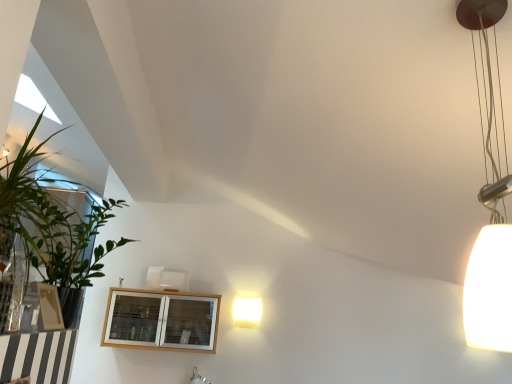
This screenshot has width=512, height=384. Describe the element at coordinates (161, 320) in the screenshot. I see `wooden cabinet at lower left` at that location.

At what (x,y) coordinates should I click in order to perform the action: click on green leafy plant at left. Please return your answer as a coordinate pair (x, y). Looking at the image, I should click on (50, 221).

The height and width of the screenshot is (384, 512). Find the location of `white matte lampshade at right, which is the 1th lamp in front-to-back order`. white matte lampshade at right, which is the 1th lamp in front-to-back order is located at coordinates (489, 196).

Does wooden cabinet at lower left have a greater height compared to matte white lamp at center, which is the first lamp from left to right?

Correct, wooden cabinet at lower left is much taller as matte white lamp at center, which is the first lamp from left to right.

Is wooden cabinet at lower left bigger or smaller than matte white lamp at center, the 1th lamp when ordered from bottom to top?

In the image, wooden cabinet at lower left appears to be larger than matte white lamp at center, the 1th lamp when ordered from bottom to top.

Can you confirm if wooden cabinet at lower left is positioned to the left of matte white lamp at center, which is the first lamp from left to right?

Yes.

How many degrees apart are the facing directions of wooden cabinet at lower left and matte white lamp at center, arranged as the first lamp when viewed from the back?

0.00335 degrees.

Is matte white lamp at center, the 2th lamp when ordered from right to left, wider than white matte lampshade at right, the first lamp when ordered from top to bottom?

In fact, matte white lamp at center, the 2th lamp when ordered from right to left, might be narrower than white matte lampshade at right, the first lamp when ordered from top to bottom.

From the picture: Could you tell me if matte white lamp at center, which is the 2th lamp from front to back, is facing white matte lampshade at right, marked as the 2th lamp in a back-to-front arrangement?

Yes, matte white lamp at center, which is the 2th lamp from front to back, is oriented towards white matte lampshade at right, marked as the 2th lamp in a back-to-front arrangement.

Is matte white lamp at center, the 1th lamp when ordered from bottom to top, placed right next to white matte lampshade at right, which ranks as the 2th lamp in bottom-to-top order?

No, matte white lamp at center, the 1th lamp when ordered from bottom to top, is not next to white matte lampshade at right, which ranks as the 2th lamp in bottom-to-top order.

Is matte white lamp at center, the 1th lamp when ordered from bottom to top, taller than white matte lampshade at right, which is the 1th lamp in front-to-back order?

In fact, matte white lamp at center, the 1th lamp when ordered from bottom to top, may be shorter than white matte lampshade at right, which is the 1th lamp in front-to-back order.

Considering the relative sizes of wooden cabinet at lower left and white matte lampshade at right, the first lamp when ordered from top to bottom, in the image provided, is wooden cabinet at lower left shorter than white matte lampshade at right, the first lamp when ordered from top to bottom,?

Yes.

Between wooden cabinet at lower left and white matte lampshade at right, which ranks as the first lamp in right-to-left order, which one has larger size?

wooden cabinet at lower left.

What are the coordinates of `lamp that is the 2nd object to the right of the wooden cabinet at lower left, starting at the anchor` in the screenshot? It's located at (489, 196).

Would you say white matte lampshade at right, the first lamp when ordered from top to bottom, is part of wooden cabinet at lower left's contents?

No, white matte lampshade at right, the first lamp when ordered from top to bottom, is not inside wooden cabinet at lower left.

Is there a large distance between green leafy plant at left and matte white lamp at center, the 2th lamp when ordered from right to left?

green leafy plant at left is far away from matte white lamp at center, the 2th lamp when ordered from right to left.

From the image's perspective, would you say green leafy plant at left is shown under matte white lamp at center, which is the first lamp from left to right?

No, from the image's perspective, green leafy plant at left is not beneath matte white lamp at center, which is the first lamp from left to right.

Can you confirm if green leafy plant at left is smaller than matte white lamp at center, the 1th lamp when ordered from bottom to top?

No, green leafy plant at left is not smaller than matte white lamp at center, the 1th lamp when ordered from bottom to top.

From a real-world perspective, is white matte lampshade at right, which is counted as the 2th lamp, starting from the left, located higher than green leafy plant at left?

Yes, from a real-world perspective, white matte lampshade at right, which is counted as the 2th lamp, starting from the left, is above green leafy plant at left.

Which object is wider, white matte lampshade at right, marked as the 2th lamp in a back-to-front arrangement, or green leafy plant at left?

green leafy plant at left.

Is there a large distance between white matte lampshade at right, which is counted as the 2th lamp, starting from the left, and green leafy plant at left?

Absolutely, white matte lampshade at right, which is counted as the 2th lamp, starting from the left, is distant from green leafy plant at left.

Does point (487, 287) appear closer or farther from the camera than point (37, 166)?

Point (487, 287).

Based on their positions, is matte white lamp at center, the 2th lamp when ordered from right to left, located to the left or right of wooden cabinet at lower left?

In the image, matte white lamp at center, the 2th lamp when ordered from right to left, appears on the right side of wooden cabinet at lower left.

Consider the image. Is there a large distance between matte white lamp at center, arranged as the first lamp when viewed from the back, and wooden cabinet at lower left?

That's not correct — matte white lamp at center, arranged as the first lamp when viewed from the back, is a little close to wooden cabinet at lower left.

Can you confirm if matte white lamp at center, arranged as the first lamp when viewed from the back, is smaller than wooden cabinet at lower left?

Yes, matte white lamp at center, arranged as the first lamp when viewed from the back, is smaller than wooden cabinet at lower left.

From their relative heights in the image, would you say matte white lamp at center, which is the first lamp from left to right, is taller or shorter than wooden cabinet at lower left?

Considering their sizes, matte white lamp at center, which is the first lamp from left to right, has less height than wooden cabinet at lower left.

Which object is closer to the camera, white matte lampshade at right, which is the 1th lamp in front-to-back order, or wooden cabinet at lower left?

Positioned in front is white matte lampshade at right, which is the 1th lamp in front-to-back order.

What are the coordinates of `window directly beneath the white matte lampshade at right, which is counted as the 2th lamp, starting from the left (from a real-world perspective)` in the screenshot? It's located at (161, 320).

Would you say white matte lampshade at right, which ranks as the 2th lamp in bottom-to-top order, is outside wooden cabinet at lower left?

Yes, white matte lampshade at right, which ranks as the 2th lamp in bottom-to-top order, is not within wooden cabinet at lower left.

Is white matte lampshade at right, which ranks as the first lamp in right-to-left order, wider or thinner than wooden cabinet at lower left?

Clearly, white matte lampshade at right, which ranks as the first lamp in right-to-left order, has less width compared to wooden cabinet at lower left.

Find the location of a particular element. Image resolution: width=512 pixels, height=384 pixels. the 1st lamp positioned above the wooden cabinet at lower left (from a real-world perspective) is located at coordinates (247, 311).

The height and width of the screenshot is (384, 512). Identify the location of lamp behind the white matte lampshade at right, marked as the 2th lamp in a back-to-front arrangement. (247, 311).

Based on their spatial positions, is white matte lampshade at right, which ranks as the first lamp in right-to-left order, or matte white lamp at center, the 2th lamp when ordered from right to left, closer to wooden cabinet at lower left?

matte white lamp at center, the 2th lamp when ordered from right to left, is positioned closer to the anchor wooden cabinet at lower left.

Consider the image. Which object lies further to the anchor point green leafy plant at left, wooden cabinet at lower left or matte white lamp at center, arranged as the first lamp when viewed from the back?

Among the two, matte white lamp at center, arranged as the first lamp when viewed from the back, is located further to green leafy plant at left.

From the image, which object appears to be nearer to wooden cabinet at lower left, white matte lampshade at right, which is the 1th lamp in front-to-back order, or green leafy plant at left?

Among the two, green leafy plant at left is located nearer to wooden cabinet at lower left.

Based on their spatial positions, is matte white lamp at center, which is the first lamp from left to right, or white matte lampshade at right, which is the 1th lamp in front-to-back order, closer to green leafy plant at left?

white matte lampshade at right, which is the 1th lamp in front-to-back order.

Estimate the real-world distances between objects in this image. Which object is further from matte white lamp at center, the 2th lamp when ordered from right to left, wooden cabinet at lower left or green leafy plant at left?

green leafy plant at left lies further to matte white lamp at center, the 2th lamp when ordered from right to left, than the other object.

Estimate the real-world distances between objects in this image. Which object is closer to white matte lampshade at right, which is the 1th lamp in front-to-back order, green leafy plant at left or wooden cabinet at lower left?

The object closer to white matte lampshade at right, which is the 1th lamp in front-to-back order, is green leafy plant at left.

Estimate the real-world distances between objects in this image. Which object is further from matte white lamp at center, which is the 2th lamp from front to back, wooden cabinet at lower left or white matte lampshade at right, which ranks as the first lamp in right-to-left order?

Among the two, white matte lampshade at right, which ranks as the first lamp in right-to-left order, is located further to matte white lamp at center, which is the 2th lamp from front to back.

Considering their positions, is matte white lamp at center, the 1th lamp when ordered from bottom to top, positioned further to wooden cabinet at lower left than green leafy plant at left?

green leafy plant at left is positioned further to the anchor wooden cabinet at lower left.

What are the coordinates of `window positioned between white matte lampshade at right, which is the 1th lamp in front-to-back order, and matte white lamp at center, the 1th lamp when ordered from bottom to top, from near to far` in the screenshot? It's located at (161, 320).

The image size is (512, 384). I want to click on houseplant located between white matte lampshade at right, which ranks as the first lamp in right-to-left order, and wooden cabinet at lower left in the depth direction, so click(x=50, y=221).

Find the location of a particular element. window located between green leafy plant at left and matte white lamp at center, arranged as the first lamp when viewed from the back, in the depth direction is located at coordinates (161, 320).

Locate an element on the screen. houseplant between white matte lampshade at right, which ranks as the first lamp in right-to-left order, and matte white lamp at center, the 1th lamp when ordered from bottom to top, from front to back is located at coordinates (50, 221).